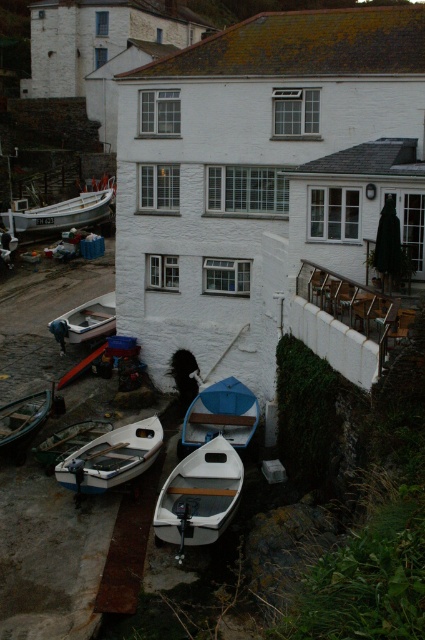
Question: Which of the following is the farthest from the observer?

Choices:
 (A) white matte boat at center
 (B) wooden boat at lower left
 (C) white matte boat at lower left

Answer: (B)

Question: Which object appears farthest from the camera in this image?

Choices:
 (A) white matte boat at center
 (B) blue matte boat at center
 (C) white matte boat at lower left

Answer: (B)

Question: Is white wooden boat at center in front of wooden boat at lower left?

Choices:
 (A) yes
 (B) no

Answer: (B)

Question: Is white matte boat at lower left to the right of white wooden boat at lower left from the viewer's perspective?

Choices:
 (A) yes
 (B) no

Answer: (A)

Question: Which is nearer to the blue matte boat at center?

Choices:
 (A) white matte boat at lower left
 (B) white wooden boat at lower left
 (C) white matte boat at center
 (D) white wooden boat at center

Answer: (A)

Question: Does blue matte boat at center appear under white wooden boat at lower left?

Choices:
 (A) no
 (B) yes

Answer: (B)